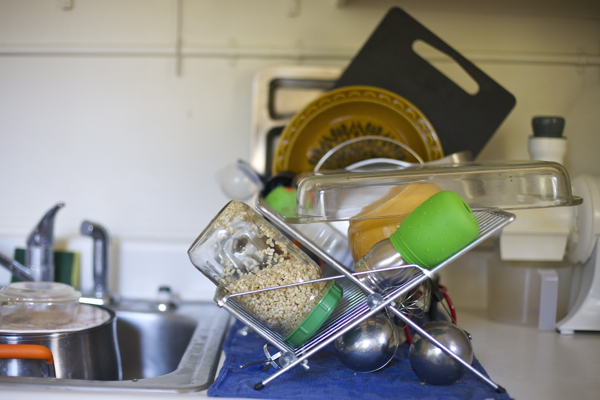
The height and width of the screenshot is (400, 600). I want to click on yellow bowl, so click(x=367, y=235).